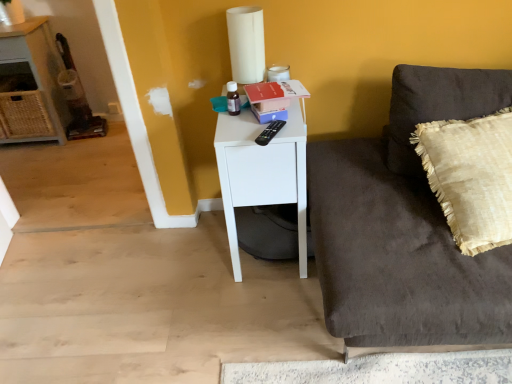
Question: Is white matte side table at center surrounding black plastic remote control at upper right?

Choices:
 (A) yes
 (B) no

Answer: (A)

Question: Is white matte side table at center closer to camera compared to black plastic remote control at upper right?

Choices:
 (A) yes
 (B) no

Answer: (B)

Question: Considering the relative sizes of white matte side table at center and black plastic remote control at upper right in the image provided, is white matte side table at center smaller than black plastic remote control at upper right?

Choices:
 (A) yes
 (B) no

Answer: (B)

Question: From the image's perspective, is white matte side table at center over black plastic remote control at upper right?

Choices:
 (A) yes
 (B) no

Answer: (B)

Question: From a real-world perspective, is white matte side table at center over black plastic remote control at upper right?

Choices:
 (A) no
 (B) yes

Answer: (A)

Question: Is white matte side table at center further to the viewer compared to black plastic remote control at upper right?

Choices:
 (A) yes
 (B) no

Answer: (A)

Question: Is black plastic remote control at upper right turned away from white matte side table at center?

Choices:
 (A) no
 (B) yes

Answer: (A)

Question: Is black plastic remote control at upper right further to the viewer compared to white matte side table at center?

Choices:
 (A) yes
 (B) no

Answer: (B)

Question: Is the position of black plastic remote control at upper right less distant than that of white matte side table at center?

Choices:
 (A) yes
 (B) no

Answer: (A)

Question: Can you confirm if black plastic remote control at upper right is shorter than white matte side table at center?

Choices:
 (A) no
 (B) yes

Answer: (B)

Question: Considering the relative sizes of black plastic remote control at upper right and white matte side table at center in the image provided, is black plastic remote control at upper right thinner than white matte side table at center?

Choices:
 (A) no
 (B) yes

Answer: (B)

Question: From the image's perspective, is black plastic remote control at upper right located beneath white matte side table at center?

Choices:
 (A) yes
 (B) no

Answer: (B)

Question: Can you confirm if beige textured pillow at right is smaller than white matte side table at center?

Choices:
 (A) no
 (B) yes

Answer: (B)